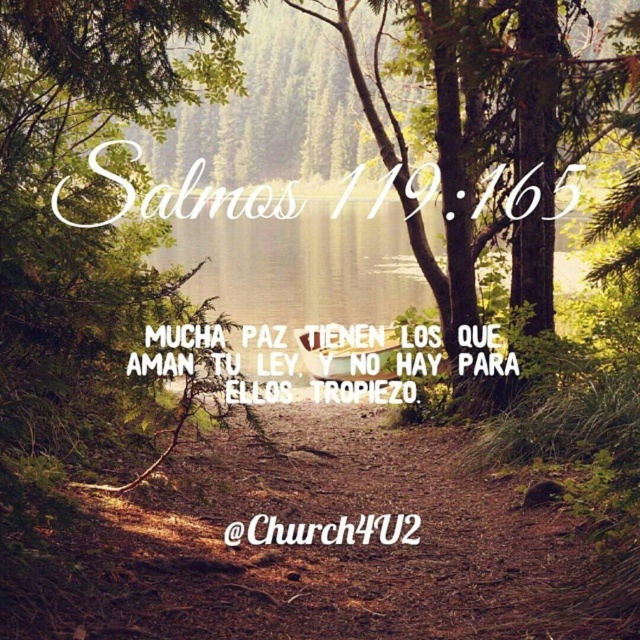
Question: Estimate the real-world distances between objects in this image. Which object is farther from the white wood sign at center?

Choices:
 (A) green matte tree at center
 (B) white paper text at center
 (C) white script text at upper center

Answer: (A)

Question: Considering the real-world distances, which object is farthest from the white paper text at center?

Choices:
 (A) white wood sign at center
 (B) green matte tree at center
 (C) white script text at upper center

Answer: (C)

Question: Does green matte tree at center appear on the right side of white paper text at center?

Choices:
 (A) no
 (B) yes

Answer: (B)

Question: Which of the following is the closest to the observer?

Choices:
 (A) white script text at upper center
 (B) green matte tree at center
 (C) white paper text at center
 (D) white wood sign at center

Answer: (B)

Question: In this image, where is white paper text at center located relative to white wood sign at center?

Choices:
 (A) below
 (B) above

Answer: (B)

Question: Can you confirm if green matte tree at center is positioned to the right of white wood sign at center?

Choices:
 (A) yes
 (B) no

Answer: (A)